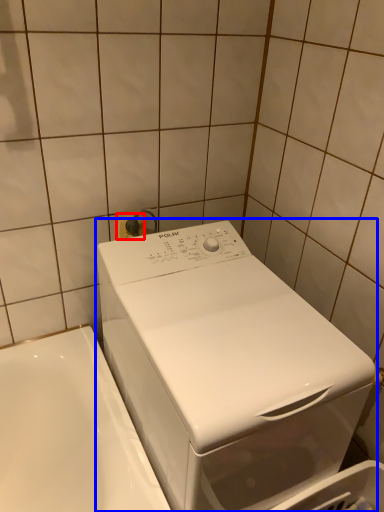
Question: Which point is further to the camera, electric outlet (highlighted by a red box) or washing machine (highlighted by a blue box)?

Choices:
 (A) electric outlet
 (B) washing machine

Answer: (A)